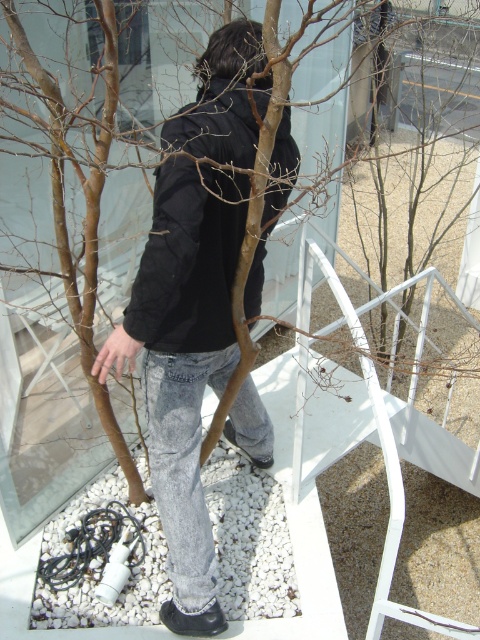
Question: Is black matte jacket at center closer to the viewer compared to black quilted jacket at center?

Choices:
 (A) no
 (B) yes

Answer: (B)

Question: Can you confirm if black matte jacket at center is smaller than black quilted jacket at center?

Choices:
 (A) no
 (B) yes

Answer: (A)

Question: Which object appears closest to the camera in this image?

Choices:
 (A) black matte jacket at center
 (B) black quilted jacket at center

Answer: (A)

Question: Among these objects, which one is farthest from the camera?

Choices:
 (A) black quilted jacket at center
 (B) black matte jacket at center

Answer: (A)

Question: Observing the image, what is the correct spatial positioning of black matte jacket at center in reference to black quilted jacket at center?

Choices:
 (A) right
 (B) left

Answer: (B)